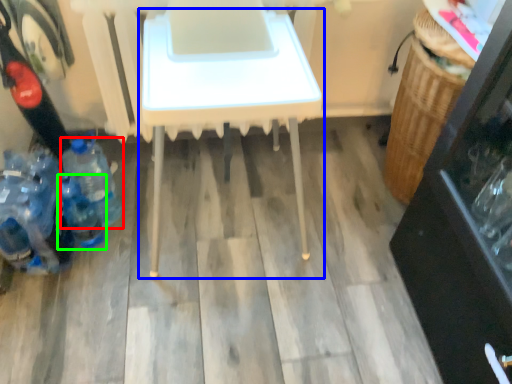
Question: Based on their relative distances, which object is farther from bottle (highlighted by a red box)? Choose from table (highlighted by a blue box) and bottle (highlighted by a green box).

Choices:
 (A) table
 (B) bottle

Answer: (A)